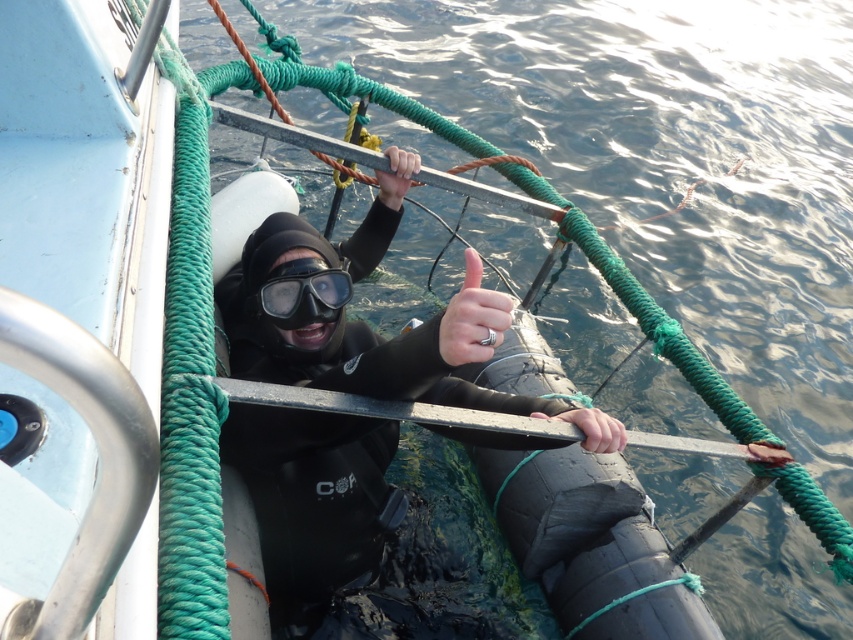
Based on the photo, you are a lifeguard observing the scene. You notice two hands in the water near the boat. The smooth black hand at center and the matte black hand at upper center. Which hand is closer to the water surface?

The smooth black hand at center is closer to the water surface because it has a lesser height compared to the matte black hand at upper center.

You are a lifeguard assessing the equipment in the image. The black matte wetsuit at center and transparent rubber goggles at center are both visible. Which piece of equipment takes up more space in the image?

The black matte wetsuit at center is larger in size than the transparent rubber goggles at center, so the black matte wetsuit at center takes up more space in the image.

You are a lifeguard assessing the safety of a diver in a boat. You notice the black matte wetsuit at center and the matte black hand at center. Which object takes up more space horizontally in the image?

The black matte wetsuit at center takes up more space horizontally than the matte black hand at center because its width is larger.